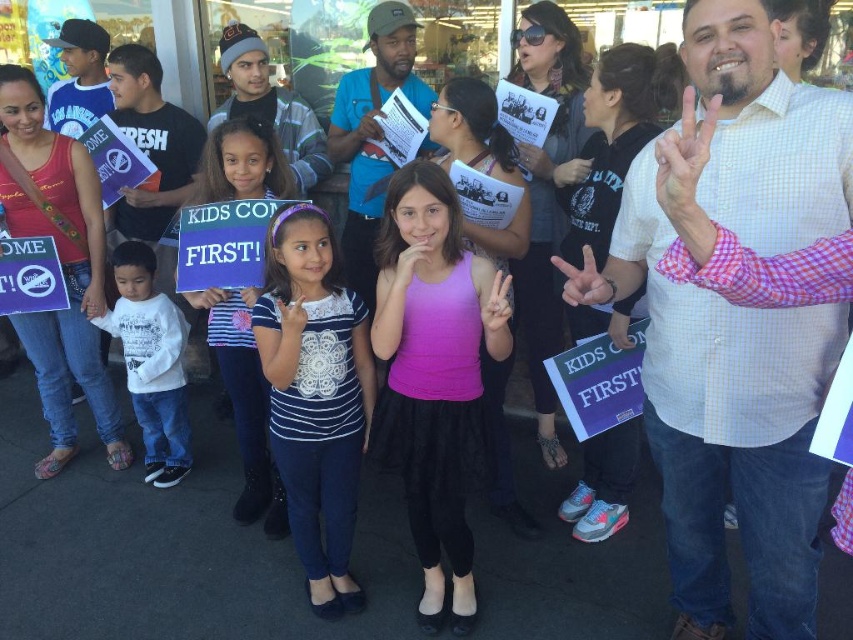
Is white lace shirt at center thinner than white cotton shirt at left?

Indeed, white lace shirt at center has a lesser width compared to white cotton shirt at left.

Between white lace shirt at center and white cotton shirt at left, which one is positioned higher?

white cotton shirt at left is higher up.

Is point (346, 372) positioned after point (171, 454)?

No, (346, 372) is closer to viewer.

Where is `white lace shirt at center`? The width and height of the screenshot is (853, 640). white lace shirt at center is located at coordinates (315, 396).

In the scene shown: Does striped fabric dress at center have a greater height compared to white cotton shirt at left?

No, striped fabric dress at center is not taller than white cotton shirt at left.

Does striped fabric dress at center appear under white cotton shirt at left?

Yes, striped fabric dress at center is below white cotton shirt at left.

The width and height of the screenshot is (853, 640). Identify the location of striped fabric dress at center. (244, 403).

Between white lace shirt at center and striped fabric dress at center, which one is positioned higher?

Positioned higher is white lace shirt at center.

Can you confirm if white lace shirt at center is positioned to the left of striped fabric dress at center?

No, white lace shirt at center is not to the left of striped fabric dress at center.

Identify the location of white lace shirt at center. (315, 396).